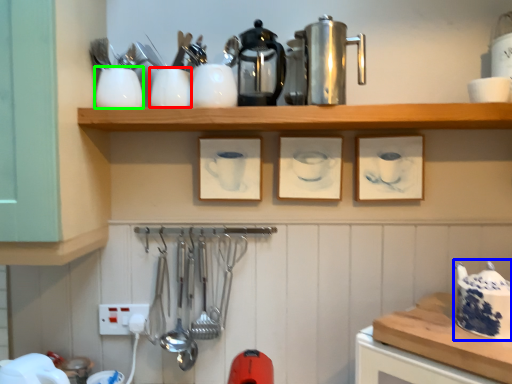
Question: Which object is positioned closest to tableware (highlighted by a red box)? Select from tea pot (highlighted by a blue box) and tableware (highlighted by a green box).

Choices:
 (A) tea pot
 (B) tableware

Answer: (B)